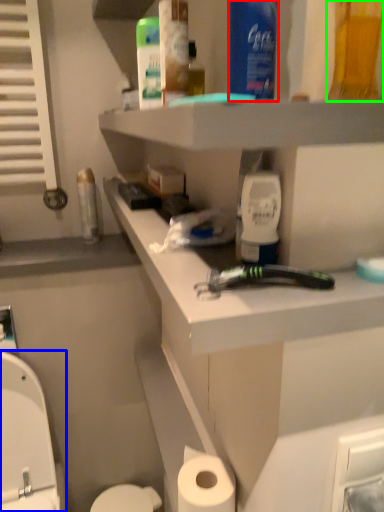
Question: Which object is positioned farthest from mouthwash (highlighted by a red box)? Select from sit (highlighted by a blue box) and mouthwash (highlighted by a green box).

Choices:
 (A) sit
 (B) mouthwash

Answer: (A)